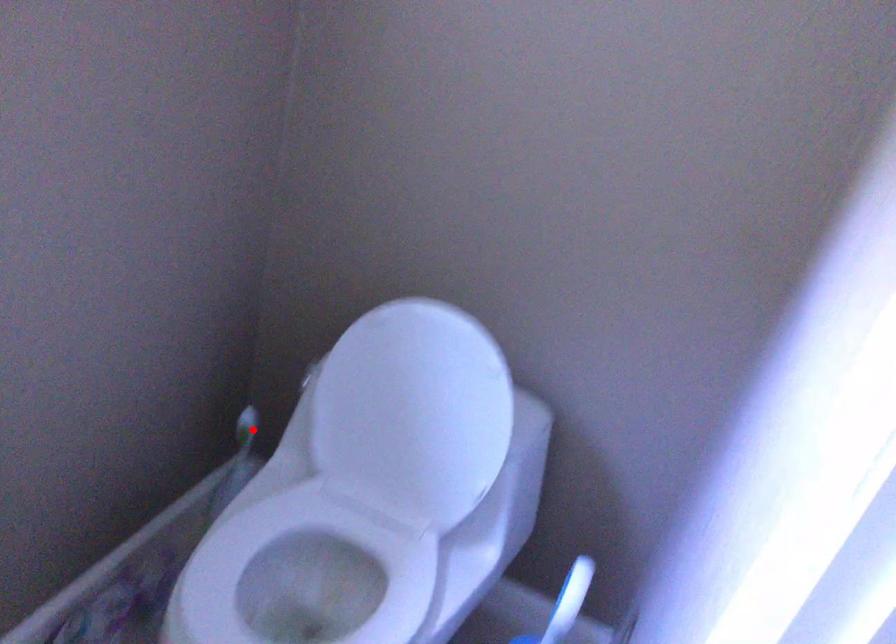
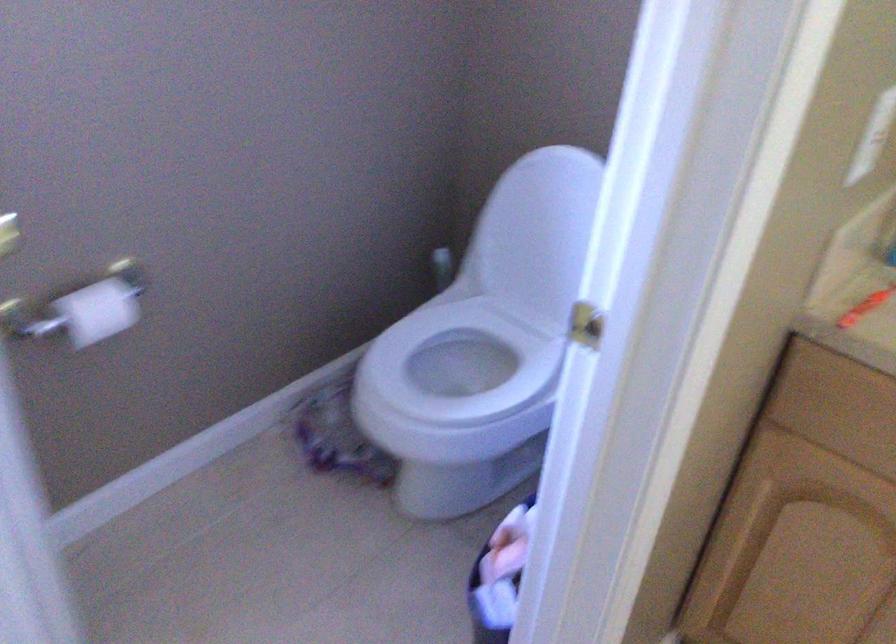
Find the pixel in the second image that matches the highlighted location in the first image.

(442, 268)